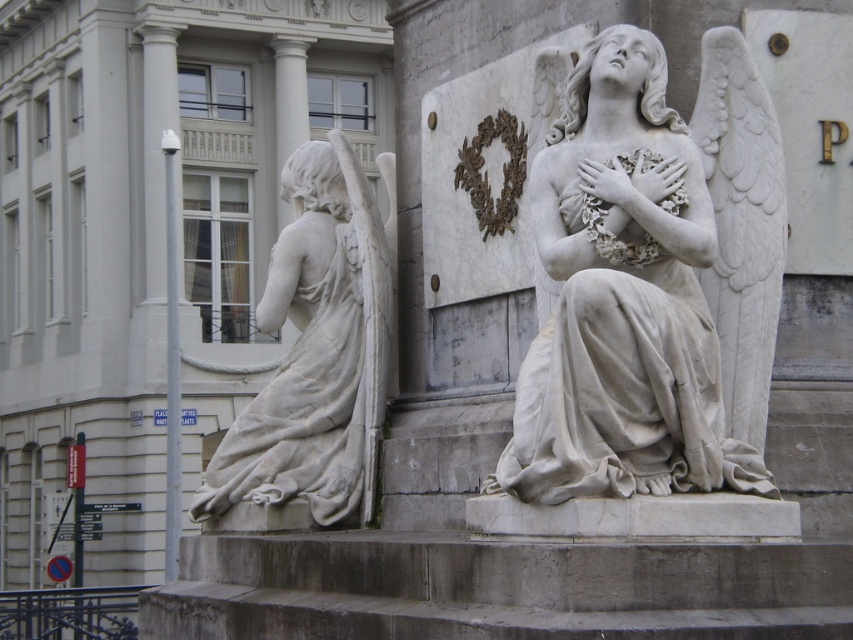
You are an art student who wants to sketch the white marble statue at center and the gray concrete stairs at center. You need to know which one is taller to adjust your drawing perspective. Can you tell me which object is taller?

The white marble statue at center is taller than the gray concrete stairs at center.